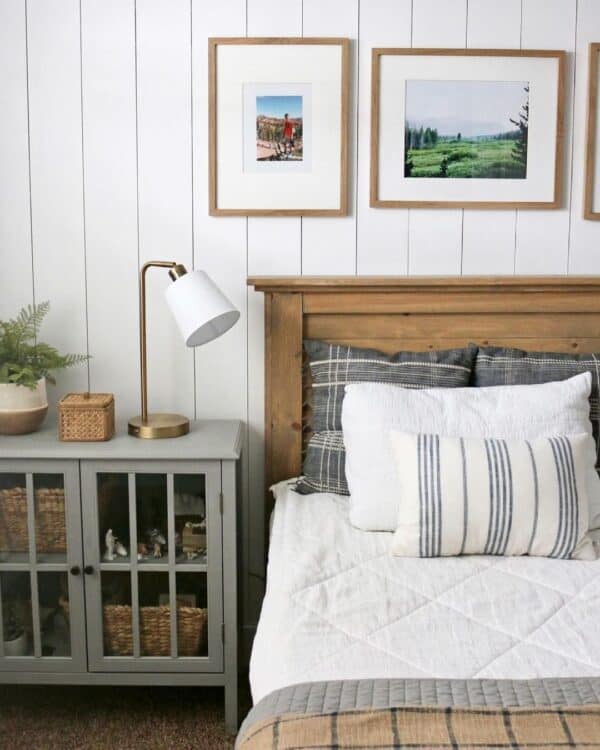
In order to click on plant pot in this screenshot , I will do `click(16, 402)`.